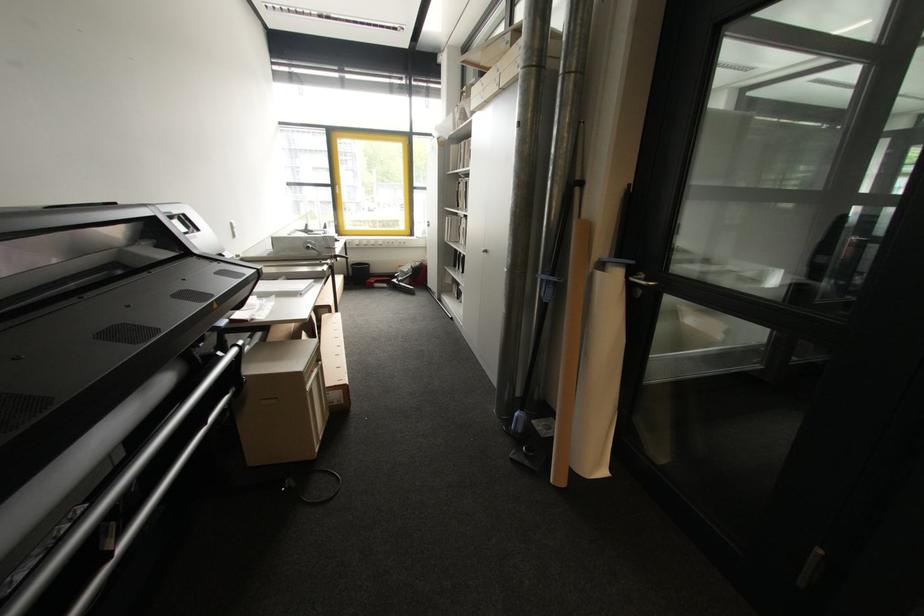
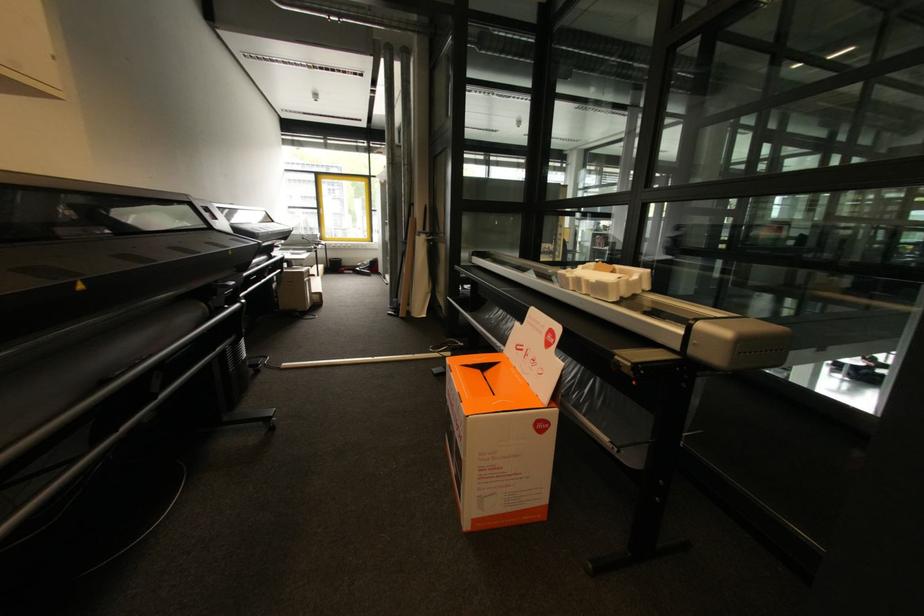
In a continuous first-person perspective shot, in which direction is the camera moving?

The cameraman moved toward right, backward.